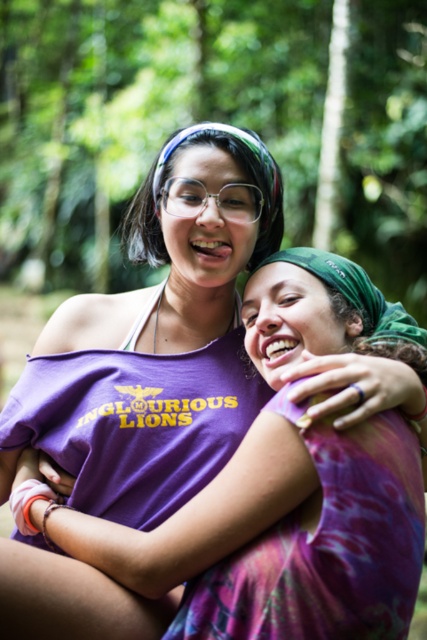
Question: Is the position of purple cotton shirt at center more distant than that of clear plastic glasses at center?

Choices:
 (A) yes
 (B) no

Answer: (B)

Question: Can you confirm if purple cotton shirt at center is positioned below clear plastic glasses at center?

Choices:
 (A) yes
 (B) no

Answer: (A)

Question: Does purple cotton shirt at center appear on the right side of clear plastic glasses at center?

Choices:
 (A) no
 (B) yes

Answer: (A)

Question: Among these points, which one is nearest to the camera?

Choices:
 (A) (257, 198)
 (B) (14, 602)

Answer: (B)

Question: Which point is closer to the camera?

Choices:
 (A) clear plastic glasses at center
 (B) purple cotton shirt at center

Answer: (B)